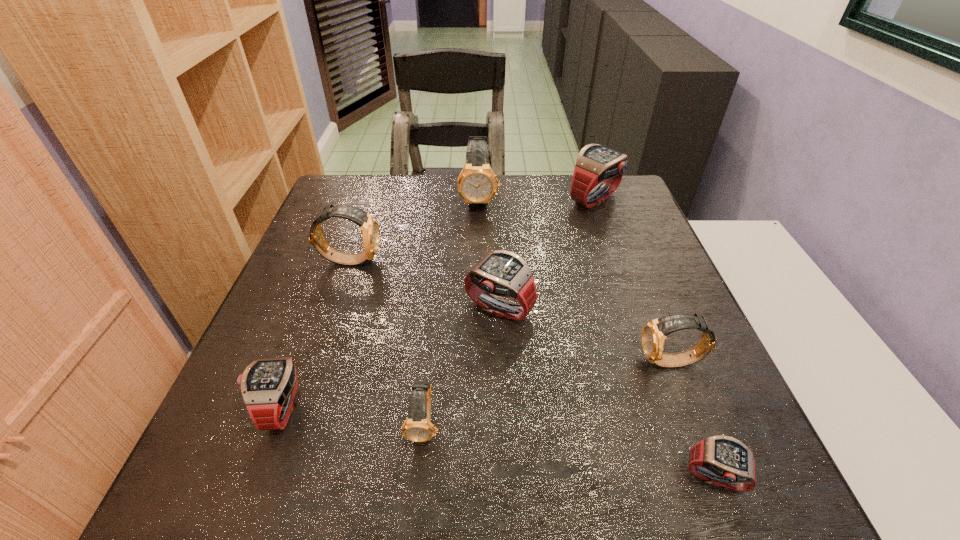
Identify the location of the tallest watch. (477, 184).

Where is `the second gold watch from right to left`? the second gold watch from right to left is located at coordinates [x=477, y=184].

Find the location of `the third smallest gold watch`. the third smallest gold watch is located at coordinates (370, 230).

Find the location of a particular element. This screenshot has height=540, width=960. the third nearest gold watch is located at coordinates (370, 230).

I want to click on the farthest red watch, so click(596, 164).

This screenshot has width=960, height=540. I want to click on the third smallest red watch, so click(x=501, y=274).

Identify the location of the fourth farthest object. (501, 274).

The image size is (960, 540). I want to click on the rightmost gold watch, so click(654, 332).

The width and height of the screenshot is (960, 540). Find the location of `the third farthest gold watch`. the third farthest gold watch is located at coordinates (654, 332).

This screenshot has height=540, width=960. I want to click on the third farthest red watch, so point(268,386).